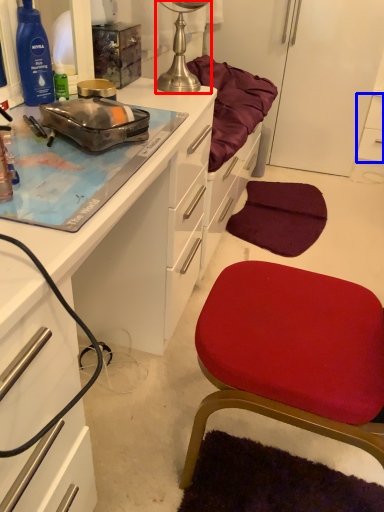
Question: Which of the following is the farthest to the observer, lamp (highlighted by a red box) or cabinetry (highlighted by a blue box)?

Choices:
 (A) lamp
 (B) cabinetry

Answer: (B)